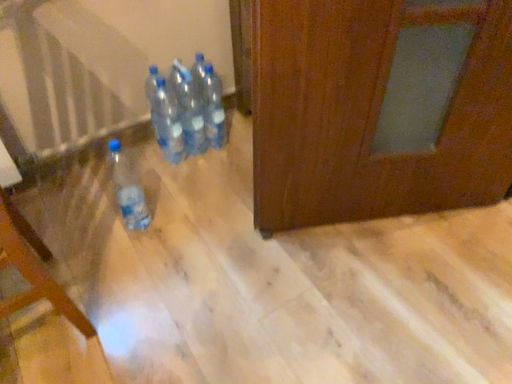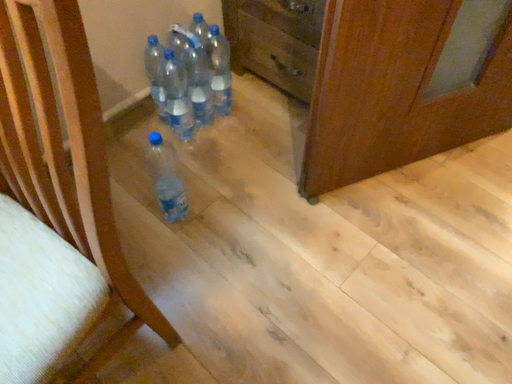
Question: How did the camera likely rotate when shooting the video?

Choices:
 (A) rotated left
 (B) rotated right

Answer: (B)